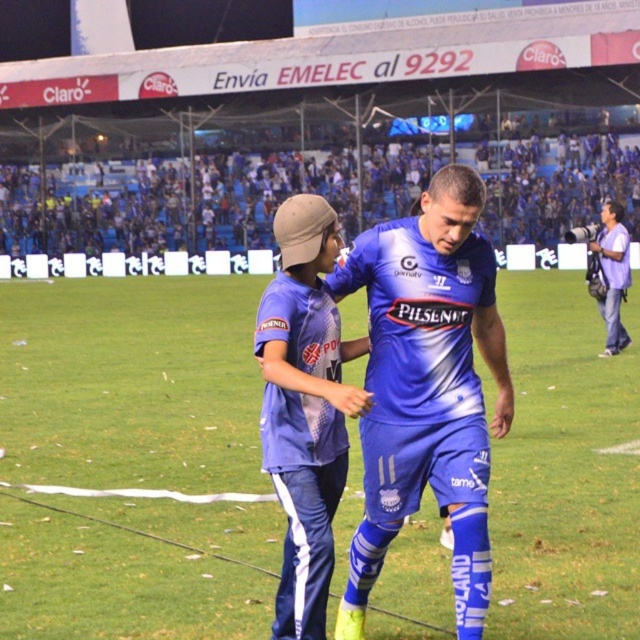
You are standing at the center of the soccer field and see the point marked at coordinates [428,387]. What object is located at that point?

The blue jersey at center is located at point [428,387].

Looking at this image, you are a photographer positioned at the edge of the soccer field. You want to capture a photo where both the blue jersey at center and the matte blue tracksuit at center are visible. Based on their heights, which clothing item will appear taller in the photo?

The blue jersey at center will appear taller in the photo because it has a greater height compared to the matte blue tracksuit at center.

You are a photographer at the soccer stadium and need to capture a photo of both the matte blue tracksuit at center and the purple cotton shirt at right. Since you want to ensure both are clearly visible, which clothing item should you focus on first to account for their size difference?

The matte blue tracksuit at center is larger than the purple cotton shirt at right, so you should focus on the matte blue tracksuit at center first to ensure its details are captured clearly before adjusting for the smaller purple cotton shirt at right.